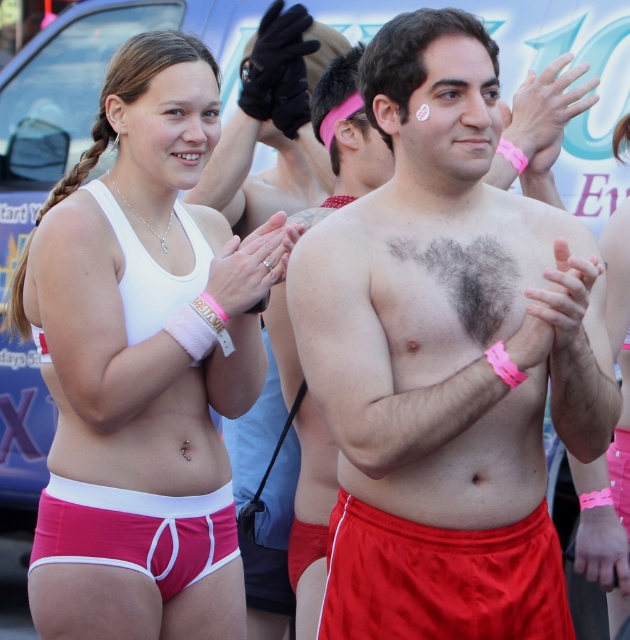
Can you confirm if pink fabric shorts at center is positioned below matte red shorts at lower center?

No.

Does pink fabric shorts at center appear on the left side of matte red shorts at lower center?

Yes, pink fabric shorts at center is to the left of matte red shorts at lower center.

Between point (231, 337) and point (484, 538), which one is positioned in front?

Positioned in front is point (484, 538).

Identify the location of pink fabric shorts at center. The height and width of the screenshot is (640, 630). (142, 362).

Is point (510, 573) behind point (478, 305)?

No, it is in front of (478, 305).

This screenshot has height=640, width=630. What do you see at coordinates (442, 579) in the screenshot?
I see `matte red shorts at lower center` at bounding box center [442, 579].

This screenshot has width=630, height=640. What are the coordinates of `matte red shorts at lower center` in the screenshot? It's located at tap(442, 579).

Is point (556, 532) behind point (115, 497)?

Yes, point (556, 532) is behind point (115, 497).

Is point (423, 541) closer to viewer compared to point (77, 500)?

Yes, point (423, 541) is in front of point (77, 500).

Who is more forward, (507, 628) or (180, 570)?

Point (507, 628)

I want to click on matte red shorts at lower center, so click(x=442, y=579).